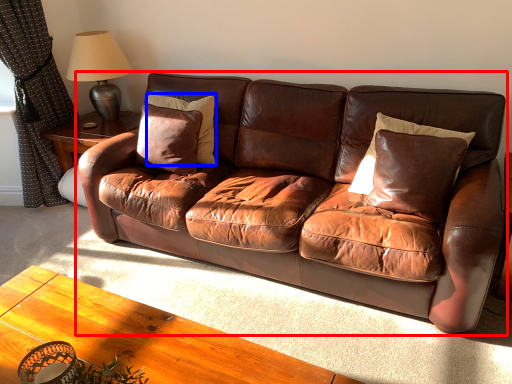
Question: Among these objects, which one is farthest to the camera, studio couch (highlighted by a red box) or pillow (highlighted by a blue box)?

Choices:
 (A) studio couch
 (B) pillow

Answer: (B)